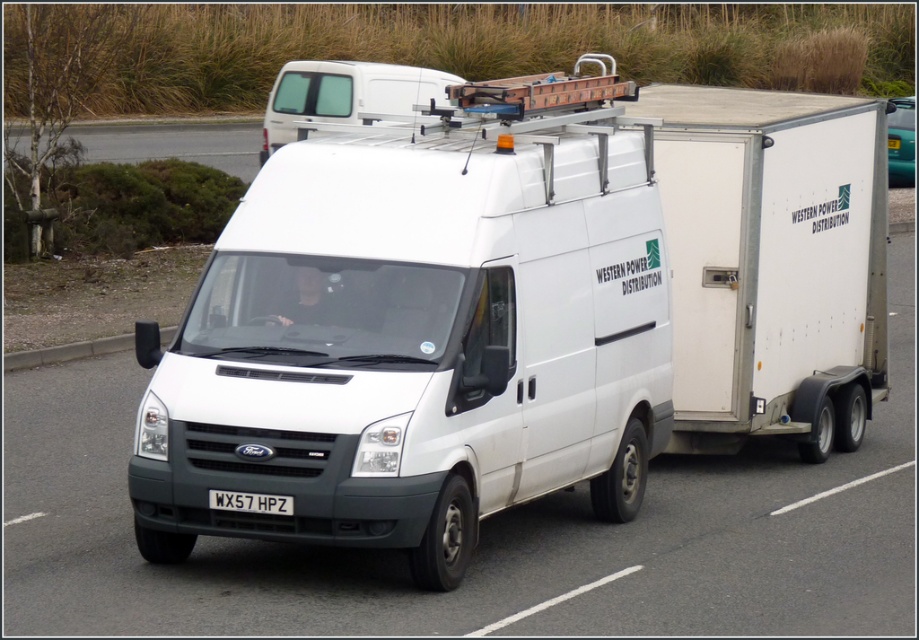
You are a traffic officer and need to record the position of the white matte van at upper center in a report. What coordinates would you use?

The coordinates for the white matte van at upper center are [345,93].

You are a traffic officer observing the road. There is a white matte van at upper center and a white matte trailer truck at center. Which one is positioned to the right side of the other?

The white matte trailer truck at center is to the right of the white matte van at upper center.